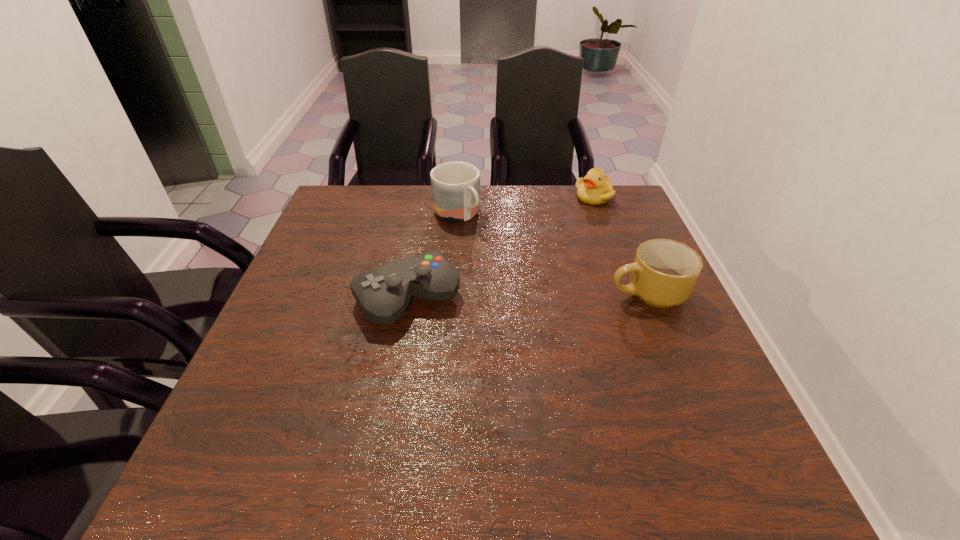
Locate an element on the screen. vacant space on the desktop that is between the control and the right mug and is positioned on the front-facing side of the duckling is located at coordinates (552, 295).

Where is `free space on the desktop that is between the control and the nearer mug and is positioned on the side with the handle of the tallest object`? The height and width of the screenshot is (540, 960). free space on the desktop that is between the control and the nearer mug and is positioned on the side with the handle of the tallest object is located at coordinates (542, 295).